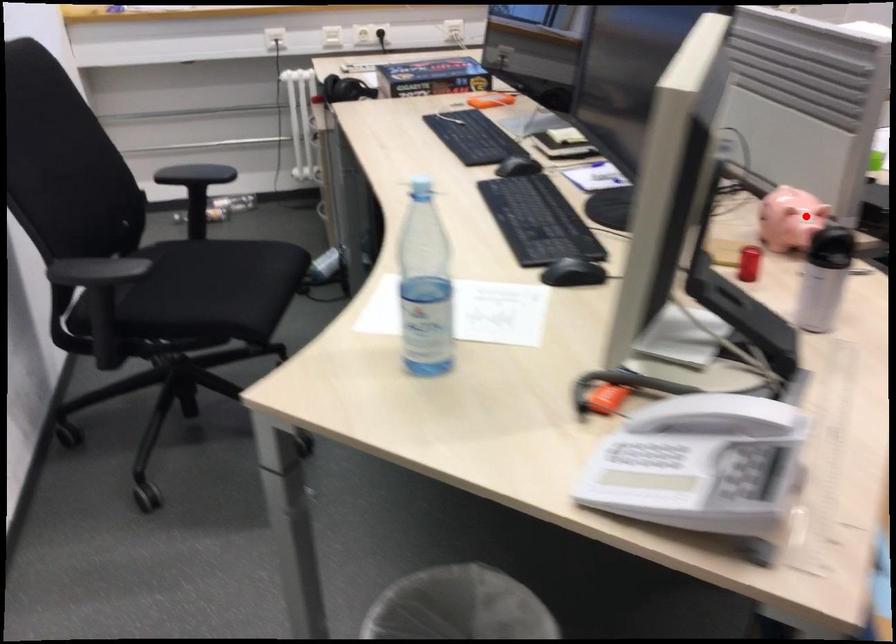
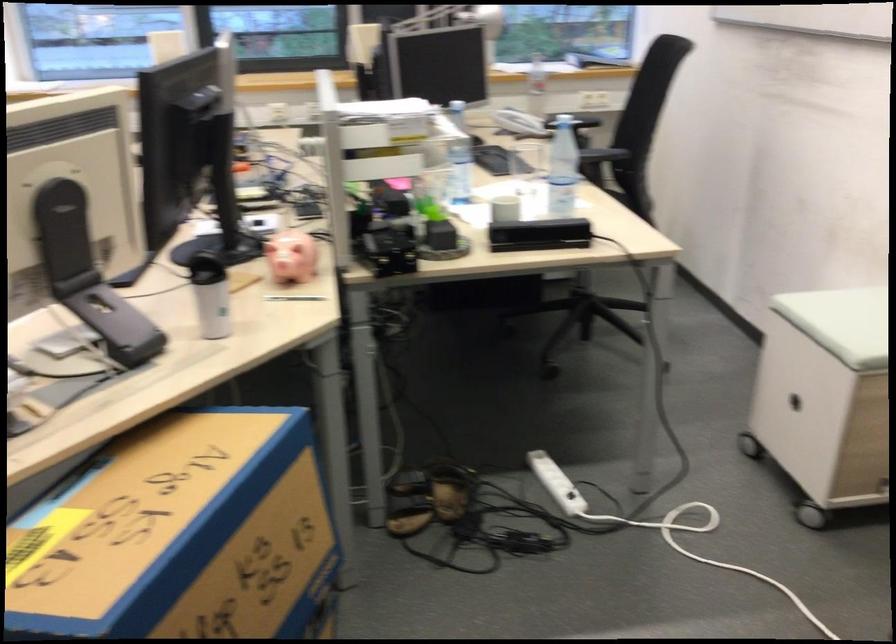
Where in the second image is the point corresponding to the highlighted location from the first image?

(291, 257)